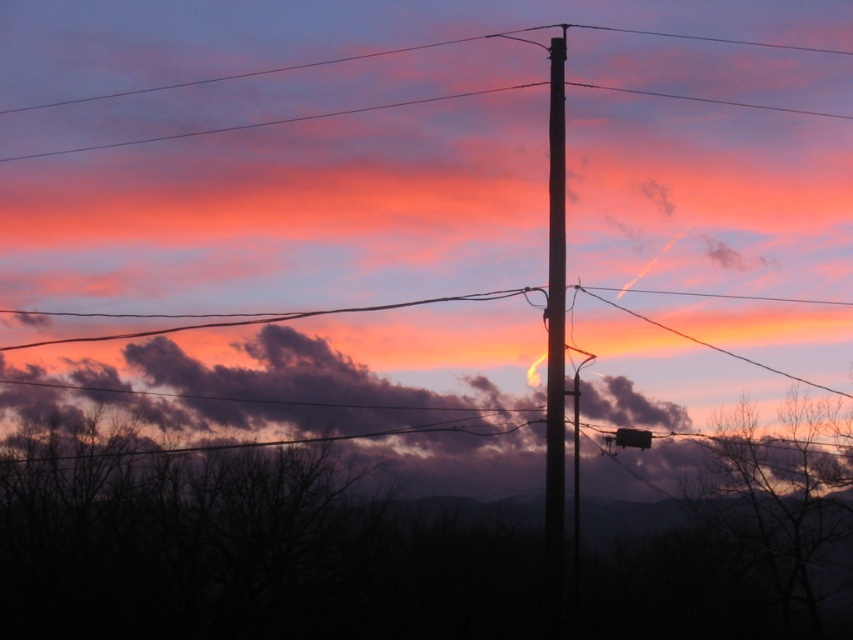
You are an artist painting the sunset scene. You want to ensure the purple matte cloud at center and smooth wood telegraph pole at center are proportionally accurate. Which object should you make wider in your painting?

The purple matte cloud at center should be made wider than the smooth wood telegraph pole at center in the painting since its width surpasses the pole.

You are an artist planning to paint the sunset scene. You want to ensure the purple matte cloud at center and the smooth wood telegraph pole at center are proportionally accurate. Which object should you paint larger?

The purple matte cloud at center should be painted larger since it has a larger size compared to the smooth wood telegraph pole at center according to the description.